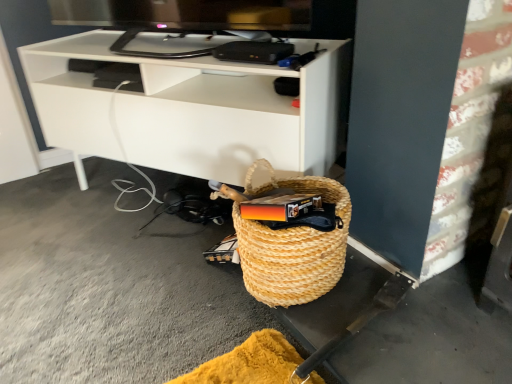
What do you see at coordinates (191, 110) in the screenshot? This screenshot has height=384, width=512. I see `white matte shelf at center` at bounding box center [191, 110].

What is the approximate width of white matte shelf at center?

19.12 inches.

Locate an element on the screen. The image size is (512, 384). white matte shelf at center is located at coordinates pos(191,110).

Image resolution: width=512 pixels, height=384 pixels. Describe the element at coordinates (292, 245) in the screenshot. I see `woven straw basket at lower right` at that location.

The image size is (512, 384). What are the coordinates of `woven straw basket at lower right` in the screenshot? It's located at (292, 245).

The width and height of the screenshot is (512, 384). I want to click on white matte shelf at center, so click(191, 110).

Visually, is white matte shelf at center positioned to the left or to the right of woven straw basket at lower right?

In the image, white matte shelf at center appears on the left side of woven straw basket at lower right.

Which object is closer to the camera, white matte shelf at center or woven straw basket at lower right?

woven straw basket at lower right is more forward.

Which point is more distant from viewer, [301,139] or [256,269]?

The point [301,139] is more distant.

From the image's perspective, would you say white matte shelf at center is shown under woven straw basket at lower right?

Incorrect, from the image's perspective, white matte shelf at center is higher than woven straw basket at lower right.

From a real-world perspective, which is physically above, white matte shelf at center or woven straw basket at lower right?

In real-world perspective, white matte shelf at center is above.

Which object is wider, white matte shelf at center or woven straw basket at lower right?

white matte shelf at center is wider.

Considering the sizes of objects white matte shelf at center and woven straw basket at lower right in the image provided, who is taller, white matte shelf at center or woven straw basket at lower right?

white matte shelf at center.

Who is smaller, white matte shelf at center or woven straw basket at lower right?

With smaller size is woven straw basket at lower right.

Is white matte shelf at center surrounding woven straw basket at lower right?

Actually, woven straw basket at lower right is outside white matte shelf at center.

Is the surface of white matte shelf at center in direct contact with woven straw basket at lower right?

They are not placed beside each other.

Is white matte shelf at center aimed at woven straw basket at lower right?

Yes, white matte shelf at center faces towards woven straw basket at lower right.

Find the location of `basket on the right of the white matte shelf at center`. basket on the right of the white matte shelf at center is located at coordinates (292, 245).

Does woven straw basket at lower right appear on the right side of white matte shelf at center?

Indeed, woven straw basket at lower right is positioned on the right side of white matte shelf at center.

Does woven straw basket at lower right lie behind white matte shelf at center?

No.

Does point (267, 272) come closer to viewer compared to point (237, 133)?

Yes, it is in front of point (237, 133).

From the image's perspective, between woven straw basket at lower right and white matte shelf at center, who is located below?

woven straw basket at lower right, from the image's perspective.

From a real-world perspective, who is located lower, woven straw basket at lower right or white matte shelf at center?

In real-world perspective, woven straw basket at lower right is lower.

Considering the relative sizes of woven straw basket at lower right and white matte shelf at center in the image provided, is woven straw basket at lower right thinner than white matte shelf at center?

Correct, the width of woven straw basket at lower right is less than that of white matte shelf at center.

Is woven straw basket at lower right taller than white matte shelf at center?

No.

Is woven straw basket at lower right bigger or smaller than white matte shelf at center?

Considering their sizes, woven straw basket at lower right takes up less space than white matte shelf at center.

Is woven straw basket at lower right outside of white matte shelf at center?

That's correct, woven straw basket at lower right is outside of white matte shelf at center.

Consider the image. Are woven straw basket at lower right and white matte shelf at center far apart?

No, woven straw basket at lower right is not far from white matte shelf at center.

Is woven straw basket at lower right facing away from white matte shelf at center?

woven straw basket at lower right does not have its back to white matte shelf at center.

Measure the distance between woven straw basket at lower right and white matte shelf at center.

woven straw basket at lower right is 14.44 inches from white matte shelf at center.

You are a GUI agent. You are given a task and a screenshot of the screen. Output one action in this format:
    pyautogui.click(x=<x>, y=<y>)
    Task: Click on the shelf behind the woven straw basket at lower right
    This screenshot has width=512, height=384.
    Given the screenshot: What is the action you would take?
    pyautogui.click(x=191, y=110)

Where is `shelf that appears above the woven straw basket at lower right (from the image's perspective)`? shelf that appears above the woven straw basket at lower right (from the image's perspective) is located at coordinates (x=191, y=110).

I want to click on basket directly beneath the white matte shelf at center (from a real-world perspective), so click(x=292, y=245).